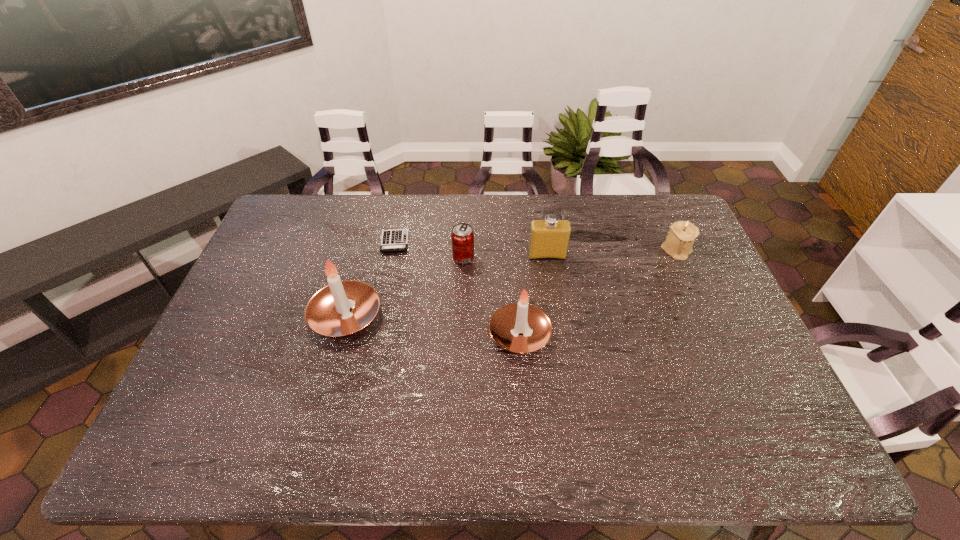
Where is `the left candle`? the left candle is located at coordinates (328, 313).

Image resolution: width=960 pixels, height=540 pixels. What are the coordinates of `the tallest object` in the screenshot? It's located at [x=328, y=313].

I want to click on the shorter candle, so click(519, 327).

Where is `calculator`? calculator is located at coordinates (392, 240).

Locate an element on the screen. This screenshot has height=540, width=960. perfume is located at coordinates (549, 238).

Locate an element on the screen. This screenshot has width=960, height=540. candle_holder is located at coordinates (679, 241).

Find the location of a particular element. This screenshot has height=540, width=960. the fourth object from right to left is located at coordinates (462, 236).

Locate an element on the screen. vacant space located on the left of the taller candle is located at coordinates (254, 315).

Identify the location of vacant space located on the back of the shorter candle. Image resolution: width=960 pixels, height=540 pixels. (514, 248).

Identify the location of free space located 0.140m on the front of the calculator. (386, 286).